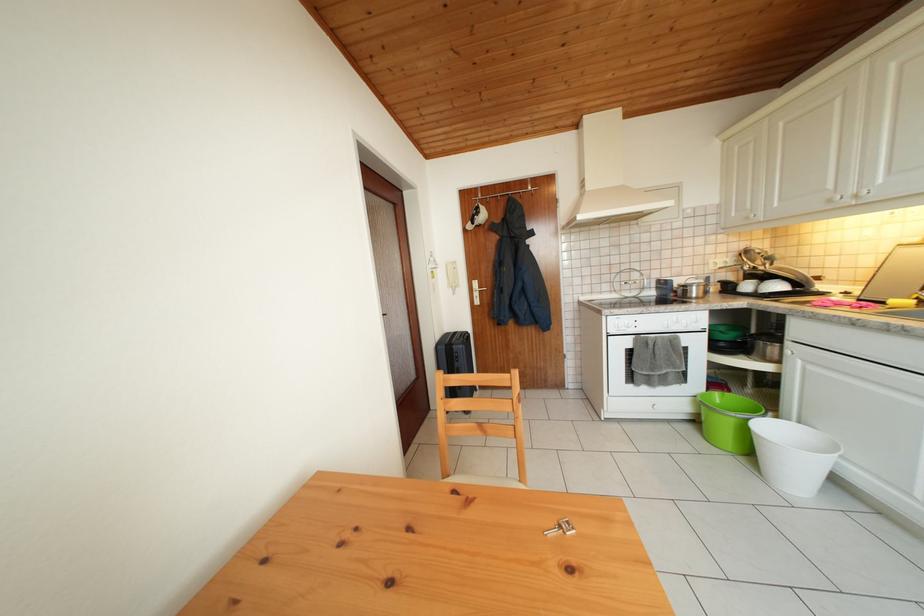
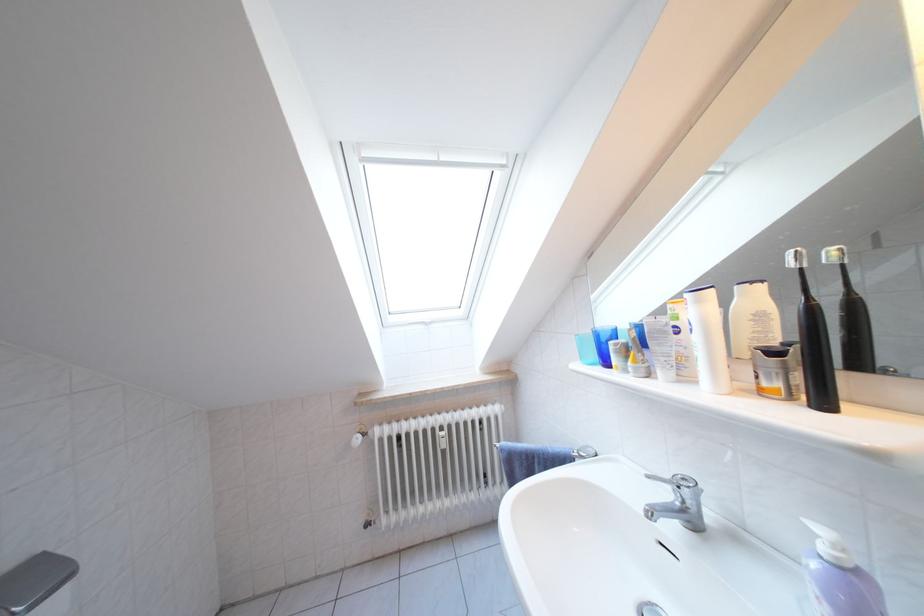
Question: In a continuous first-person perspective shot, in which direction is the camera moving?

Choices:
 (A) Left
 (B) Right
 (C) Forward
 (D) Backward

Answer: (B)